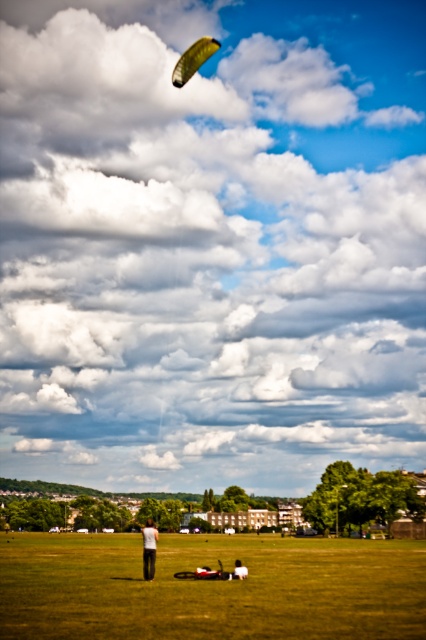
Question: Which of the following is the farthest from the observer?

Choices:
 (A) (152, 536)
 (B) (192, 56)
 (C) (233, 576)
 (D) (63, 538)

Answer: (D)

Question: Where is green grass at center located in relation to dark gray pants at center in the image?

Choices:
 (A) below
 (B) above

Answer: (A)

Question: Which point appears farthest from the camera in this image?

Choices:
 (A) (152, 577)
 (B) (236, 568)

Answer: (B)

Question: Which is nearer to the white cotton shirt at center?

Choices:
 (A) dark gray pants at center
 (B) green grass at center
 (C) green fabric parachute at upper center

Answer: (A)

Question: Is green grass at center below dark gray pants at center?

Choices:
 (A) no
 (B) yes

Answer: (B)

Question: Can you confirm if white cotton shirt at center is positioned to the right of dark gray pants at center?

Choices:
 (A) yes
 (B) no

Answer: (B)